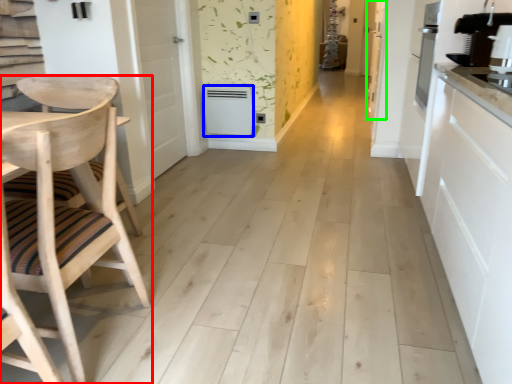
Question: Estimate the real-world distances between objects in this image. Which object is farther from chair (highlighted by a red box), appliance (highlighted by a blue box) or door (highlighted by a green box)?

Choices:
 (A) appliance
 (B) door

Answer: (B)